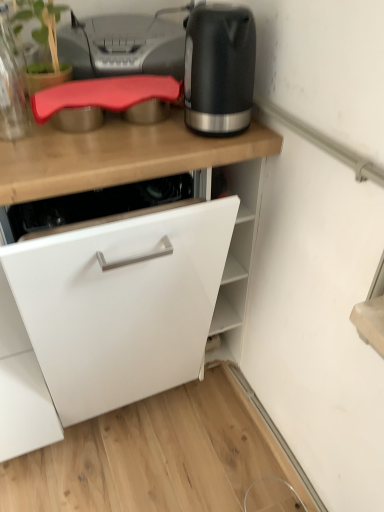
Question: Is white matte cabinet at center to the right of matte black kettle at upper right from the viewer's perspective?

Choices:
 (A) no
 (B) yes

Answer: (A)

Question: Is white matte cabinet at center further to the viewer compared to matte black kettle at upper right?

Choices:
 (A) no
 (B) yes

Answer: (A)

Question: From the image's perspective, does white matte cabinet at center appear lower than matte black kettle at upper right?

Choices:
 (A) no
 (B) yes

Answer: (B)

Question: Is matte black kettle at upper right surrounded by white matte cabinet at center?

Choices:
 (A) yes
 (B) no

Answer: (B)

Question: From a real-world perspective, is white matte cabinet at center over matte black kettle at upper right?

Choices:
 (A) yes
 (B) no

Answer: (B)

Question: Is matte gray printer at upper center to the left or to the right of translucent glass jar at upper left in the image?

Choices:
 (A) right
 (B) left

Answer: (A)

Question: From the image's perspective, is matte gray printer at upper center above or below translucent glass jar at upper left?

Choices:
 (A) above
 (B) below

Answer: (A)

Question: In terms of width, does matte gray printer at upper center look wider or thinner when compared to translucent glass jar at upper left?

Choices:
 (A) thin
 (B) wide

Answer: (A)

Question: Looking at the image, does matte gray printer at upper center seem bigger or smaller compared to translucent glass jar at upper left?

Choices:
 (A) big
 (B) small

Answer: (A)

Question: Considering the positions of white matte cabinet at center and matte gray printer at upper center in the image, is white matte cabinet at center wider or thinner than matte gray printer at upper center?

Choices:
 (A) thin
 (B) wide

Answer: (B)

Question: Based on their sizes in the image, would you say white matte cabinet at center is bigger or smaller than matte gray printer at upper center?

Choices:
 (A) big
 (B) small

Answer: (A)

Question: From the image's perspective, is white matte cabinet at center above or below matte gray printer at upper center?

Choices:
 (A) above
 (B) below

Answer: (B)

Question: From a real-world perspective, is white matte cabinet at center positioned above or below matte gray printer at upper center?

Choices:
 (A) above
 (B) below

Answer: (B)

Question: Considering their positions, is white matte cabinet at center located in front of or behind matte black kettle at upper right?

Choices:
 (A) front
 (B) behind

Answer: (A)

Question: Is white matte cabinet at center bigger or smaller than matte black kettle at upper right?

Choices:
 (A) small
 (B) big

Answer: (B)